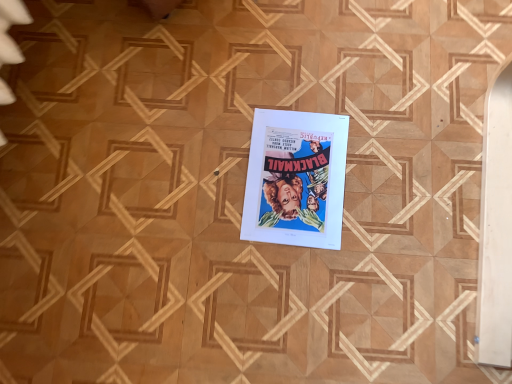
This screenshot has height=384, width=512. What do you see at coordinates (296, 179) in the screenshot?
I see `matte paper poster at center` at bounding box center [296, 179].

What is the approximate width of matte paper poster at center?

matte paper poster at center is 11.89 inches wide.

The height and width of the screenshot is (384, 512). What are the coordinates of `matte paper poster at center` in the screenshot? It's located at (296, 179).

The image size is (512, 384). I want to click on matte paper poster at center, so click(296, 179).